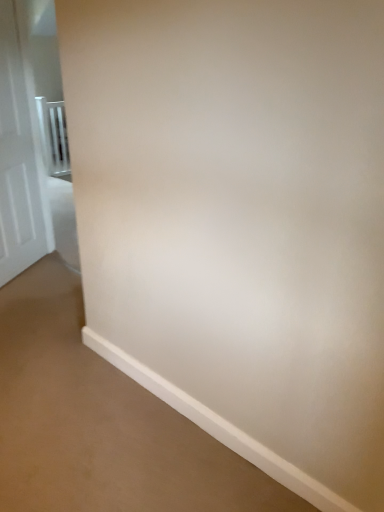
Question: From their relative heights in the image, would you say metallic silver balustrade at left is taller or shorter than white glossy door at left?

Choices:
 (A) short
 (B) tall

Answer: (A)

Question: In terms of size, does metallic silver balustrade at left appear bigger or smaller than white glossy door at left?

Choices:
 (A) small
 (B) big

Answer: (A)

Question: Would you say metallic silver balustrade at left is to the left or to the right of white glossy door at left in the picture?

Choices:
 (A) left
 (B) right

Answer: (A)

Question: From the image's perspective, is white glossy door at left above or below metallic silver balustrade at left?

Choices:
 (A) above
 (B) below

Answer: (B)

Question: From a real-world perspective, is white glossy door at left above or below metallic silver balustrade at left?

Choices:
 (A) below
 (B) above

Answer: (B)

Question: In terms of size, does white glossy door at left appear bigger or smaller than metallic silver balustrade at left?

Choices:
 (A) small
 (B) big

Answer: (B)

Question: In the image, is white glossy door at left positioned in front of or behind metallic silver balustrade at left?

Choices:
 (A) behind
 (B) front

Answer: (B)